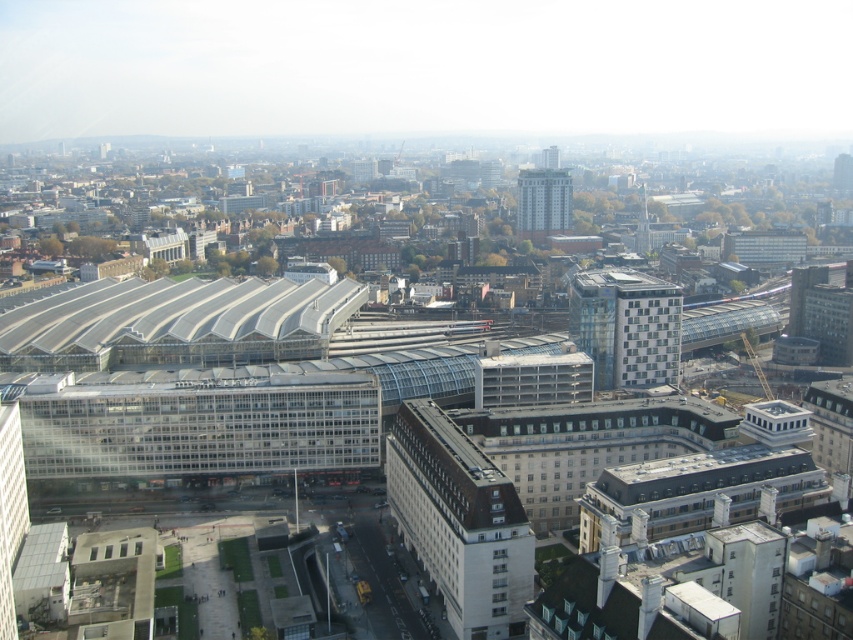
Question: Can you confirm if dark gray concrete building at center is wider than glassy blue building at center?

Choices:
 (A) no
 (B) yes

Answer: (A)

Question: Is glassy blue building at center closer to camera compared to gray concrete building at center?

Choices:
 (A) yes
 (B) no

Answer: (A)

Question: Can you confirm if dark gray concrete building at center is positioned to the left of glassy blue building at center?

Choices:
 (A) no
 (B) yes

Answer: (B)

Question: Which object appears farthest from the camera in this image?

Choices:
 (A) gray concrete building at center
 (B) dark gray concrete building at center

Answer: (A)

Question: Which point is closer to the camera?

Choices:
 (A) glassy blue building at center
 (B) gray concrete building at center
 (C) dark gray concrete building at center

Answer: (C)

Question: Among these objects, which one is farthest from the camera?

Choices:
 (A) glassy blue building at center
 (B) gray concrete building at center

Answer: (B)